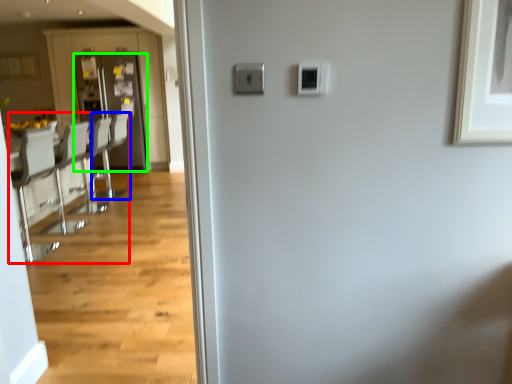
Question: Which is nearer to the furniture (highlighted by a red box)? armchair (highlighted by a blue box) or door (highlighted by a green box).

Choices:
 (A) armchair
 (B) door

Answer: (A)